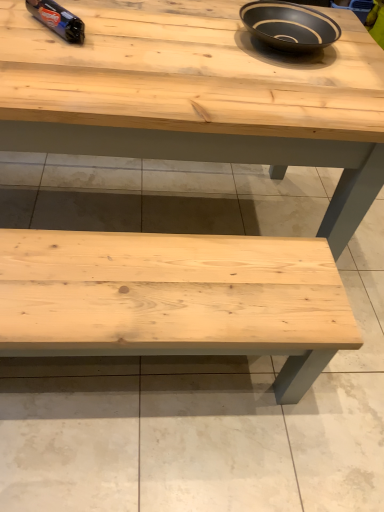
Identify the location of vacant region under black matte bowl at upper center (from a real-world perspective). (298, 46).